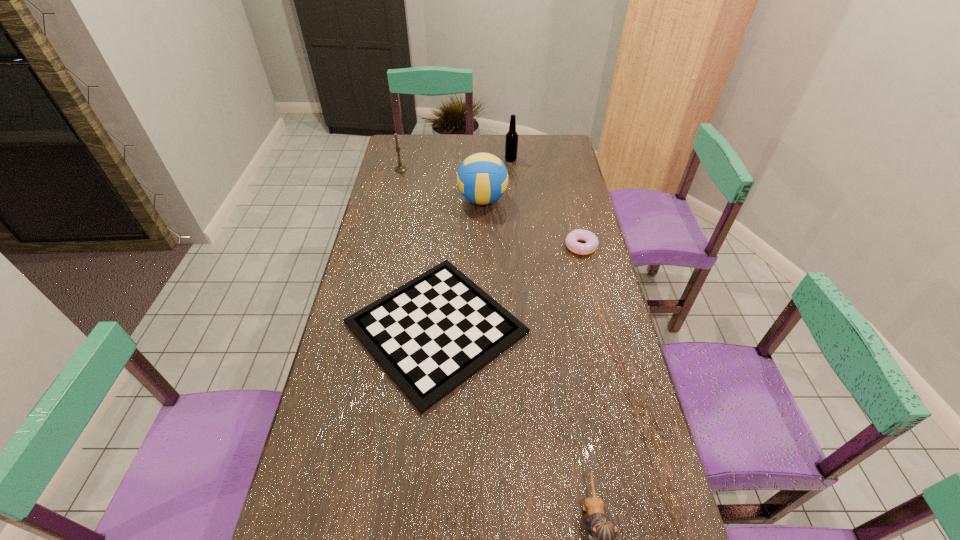
Locate an element on the screen. The image size is (960, 540). free spot at the far left corner of the desktop is located at coordinates (417, 147).

At what (x,y) coordinates should I click in order to perform the action: click on empty space between the farthest object and the fifth nearest object. Please return your answer as a coordinate pair (x, y). This screenshot has width=960, height=540. Looking at the image, I should click on (456, 165).

Locate an element on the screen. The width and height of the screenshot is (960, 540). unoccupied area between the fourth nearest object and the fifth nearest object is located at coordinates (442, 185).

Find the location of a particular element. vacant space that is in between the rightmost object and the volleyball is located at coordinates (532, 223).

This screenshot has width=960, height=540. I want to click on free spot between the shortest object and the volleyball, so click(x=459, y=264).

At what (x,y) coordinates should I click in order to perform the action: click on free point between the second shortest object and the candle. Please return your answer as a coordinate pair (x, y). Looking at the image, I should click on (491, 208).

I want to click on vacant area that lies between the beer bottle and the third tallest object, so click(x=456, y=165).

Locate an element on the screen. free space between the volleyball and the candle is located at coordinates (442, 185).

The image size is (960, 540). I want to click on the fifth closest object to the farthest object, so click(x=603, y=536).

This screenshot has height=540, width=960. I want to click on object that is the nearest to the checkerboard, so click(590, 246).